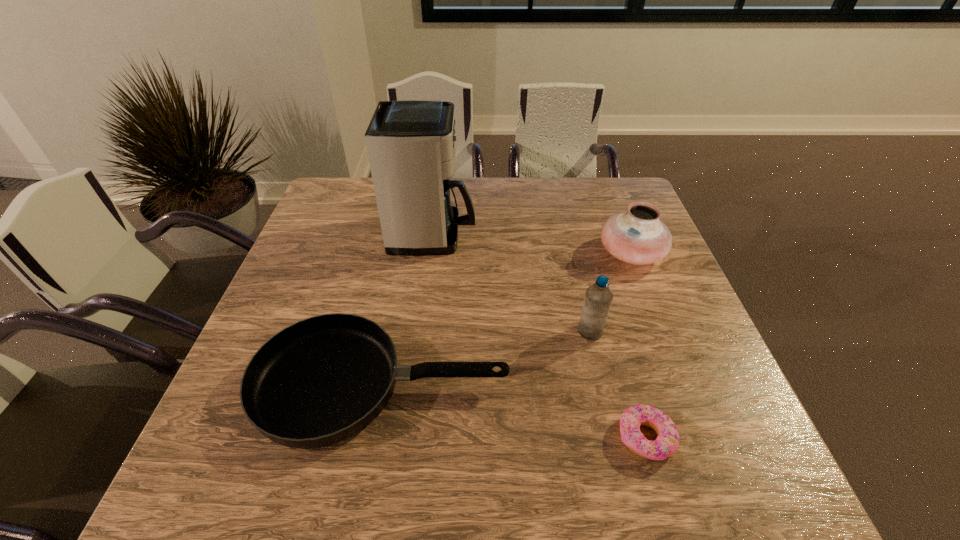
Choose which object is the second nearest neighbor to the shortest object. Please provide its 2D coordinates. Your answer should be formatted as a tuple, i.e. [(x, y)], where the tuple contains the x and y coordinates of a point satisfying the conditions above.

[(321, 380)]

Locate an element on the screen. This screenshot has height=540, width=960. vacant space that satisfies the following two spatial constraints: 1. on the back side of the water bottle; 2. on the right side of the pottery is located at coordinates (572, 253).

Where is `vacant space that satisfies the following two spatial constraints: 1. at the end of the handle of the second shortest object; 2. on the back side of the shortest object`? vacant space that satisfies the following two spatial constraints: 1. at the end of the handle of the second shortest object; 2. on the back side of the shortest object is located at coordinates (372, 438).

Locate an element on the screen. The width and height of the screenshot is (960, 540). free location that satisfies the following two spatial constraints: 1. on the front panel of the water bottle; 2. on the right side of the coffee maker is located at coordinates (421, 332).